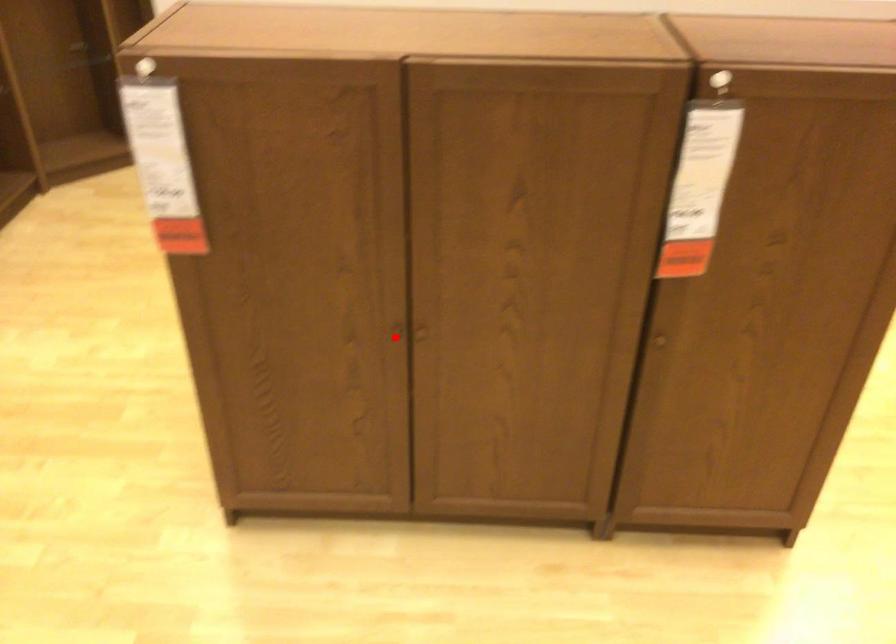
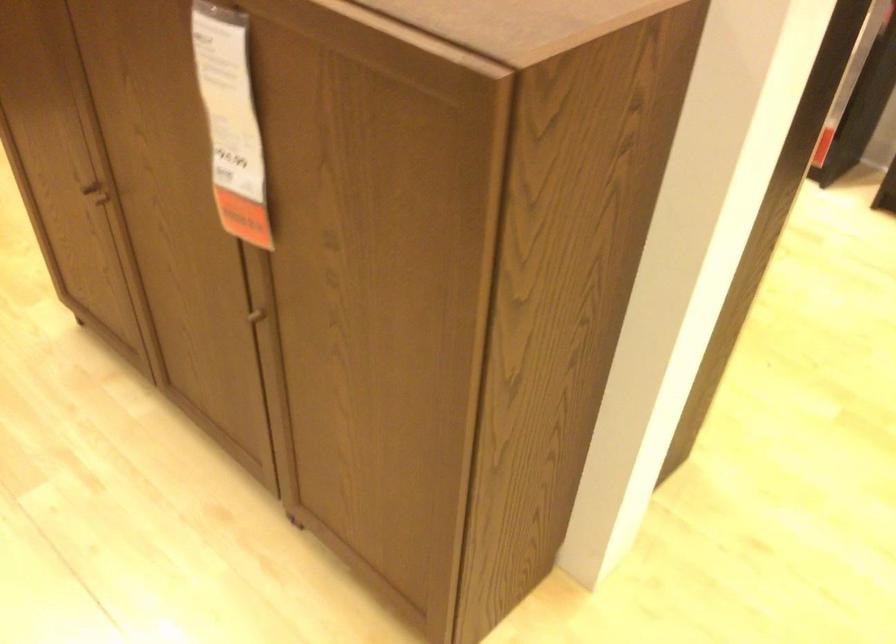
Find the pixel in the second image that matches the highlighted location in the first image.

(95, 196)